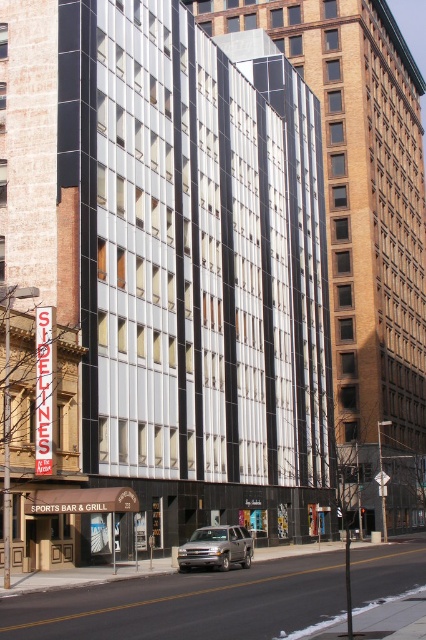
Question: Considering the relative positions of glassy reflective building at center and silver metallic suv at center in the image provided, where is glassy reflective building at center located with respect to silver metallic suv at center?

Choices:
 (A) left
 (B) right

Answer: (B)

Question: Observing the image, what is the correct spatial positioning of glassy reflective building at center in reference to silver metallic suv at center?

Choices:
 (A) below
 (B) above

Answer: (B)

Question: Which point is closer to the camera taking this photo?

Choices:
 (A) (207, 547)
 (B) (365, 522)

Answer: (A)

Question: Among these objects, which one is farthest from the camera?

Choices:
 (A) silver metallic suv at center
 (B) glassy reflective building at center

Answer: (B)

Question: Considering the relative positions of glassy reflective building at center and silver metallic suv at center in the image provided, where is glassy reflective building at center located with respect to silver metallic suv at center?

Choices:
 (A) below
 (B) above

Answer: (B)